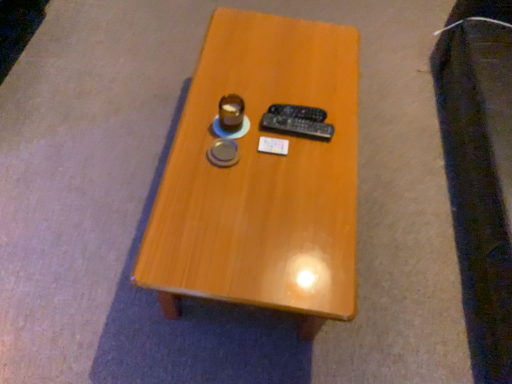
Locate an element on the screen. vacant area that is situated to the right of matte brown coffee cup at center is located at coordinates (284, 135).